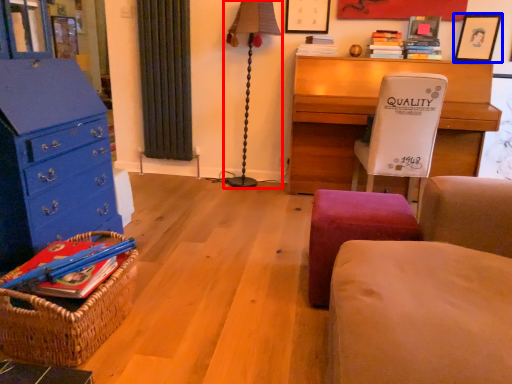
Question: Among these objects, which one is nearest to the camera, table lamp (highlighted by a red box) or picture frame (highlighted by a blue box)?

Choices:
 (A) table lamp
 (B) picture frame

Answer: (B)